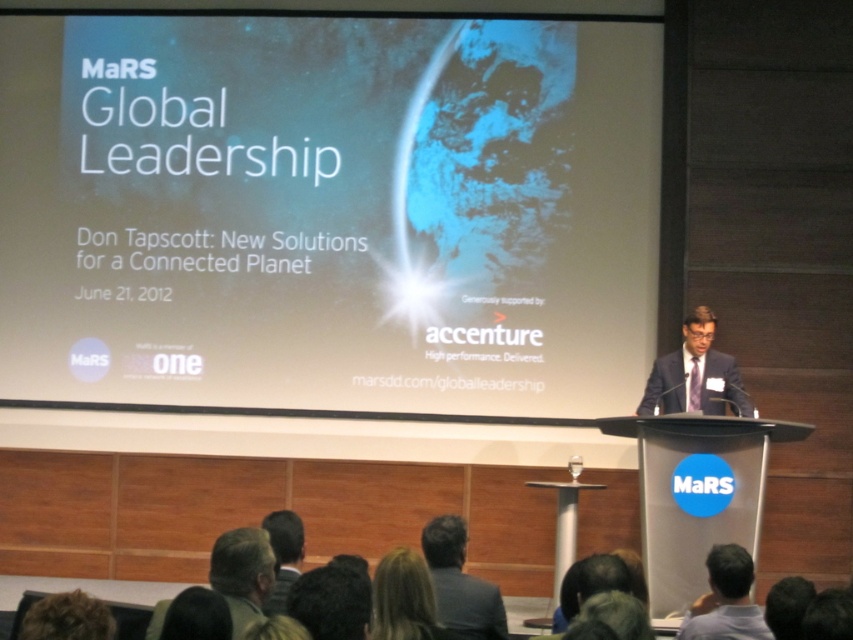
Question: Does white matte projection screen at upper center have a greater width compared to dark gray suit at lower center?

Choices:
 (A) no
 (B) yes

Answer: (B)

Question: Is white matte projection screen at upper center to the right of dark gray suit at center from the viewer's perspective?

Choices:
 (A) no
 (B) yes

Answer: (A)

Question: Which object appears farthest from the camera in this image?

Choices:
 (A) dark brown hair at lower center
 (B) dark gray suit at center
 (C) dark blue suit at center

Answer: (C)

Question: Is dark blue suit at center positioned at the back of dark gray suit at lower center?

Choices:
 (A) yes
 (B) no

Answer: (A)

Question: Which point appears farthest from the camera in this image?

Choices:
 (A) (274, 556)
 (B) (634, 260)
 (C) (381, 604)
 (D) (689, 390)

Answer: (B)

Question: Which of the following is the closest to the observer?

Choices:
 (A) blonde hair at lower center
 (B) dark blue suit at center

Answer: (A)